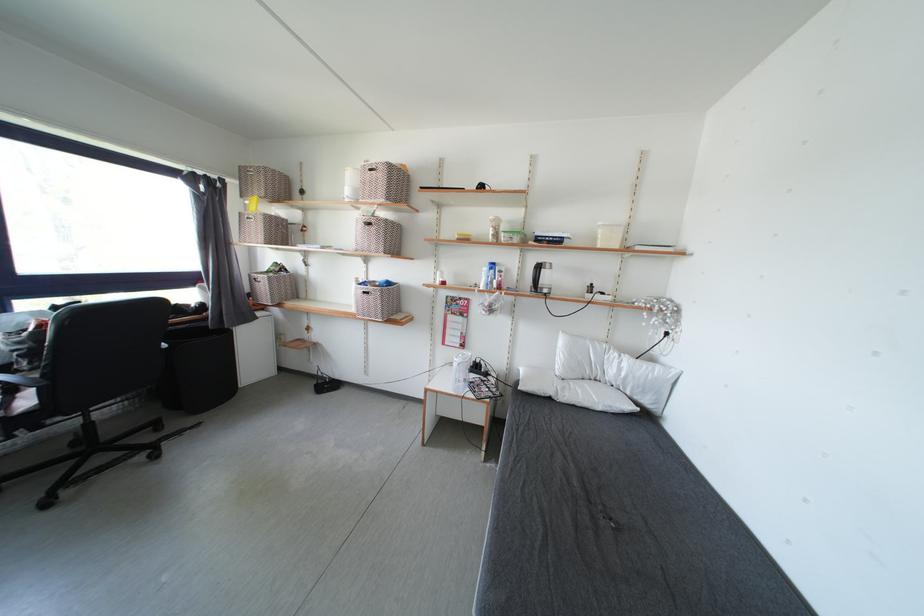
Where is `black chair armrest`? This screenshot has height=616, width=924. black chair armrest is located at coordinates (28, 379).